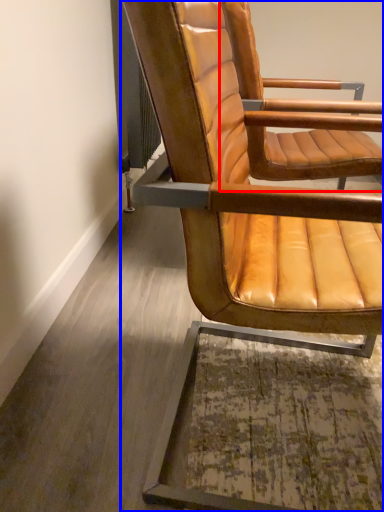
Question: Which point is further to the camera, chair (highlighted by a red box) or chair (highlighted by a blue box)?

Choices:
 (A) chair
 (B) chair

Answer: (A)